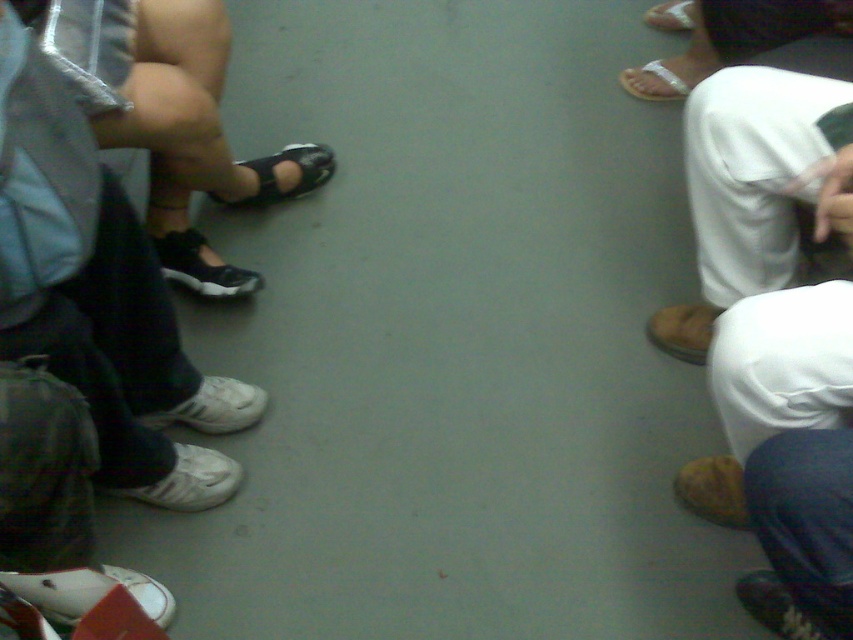
Question: From the image, what is the correct spatial relationship of clear plastic sandal at upper right in relation to brown leather sandal at upper right?

Choices:
 (A) below
 (B) above

Answer: (A)

Question: Is black leather sandal at center-left positioned in front of brown leather sandal at upper right?

Choices:
 (A) no
 (B) yes

Answer: (B)

Question: Considering the relative positions of black leather sandal at center and brown leather sandal at upper right in the image provided, where is black leather sandal at center located with respect to brown leather sandal at upper right?

Choices:
 (A) above
 (B) below

Answer: (B)

Question: Which object is the closest to the clear plastic sandal at upper right?

Choices:
 (A) black leather sandal at center
 (B) brown leather sandal at upper right

Answer: (B)

Question: Which of the following is the farthest from the observer?

Choices:
 (A) black leather sandal at center
 (B) clear plastic sandal at upper right
 (C) brown leather sandal at upper right

Answer: (C)

Question: Which of the following is the farthest from the observer?

Choices:
 (A) (239, 268)
 (B) (664, 10)

Answer: (B)